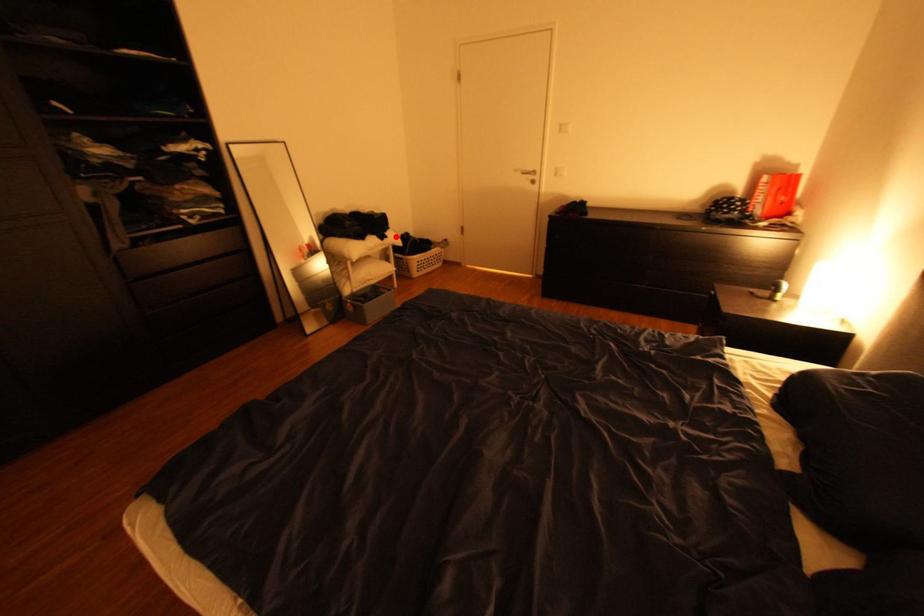
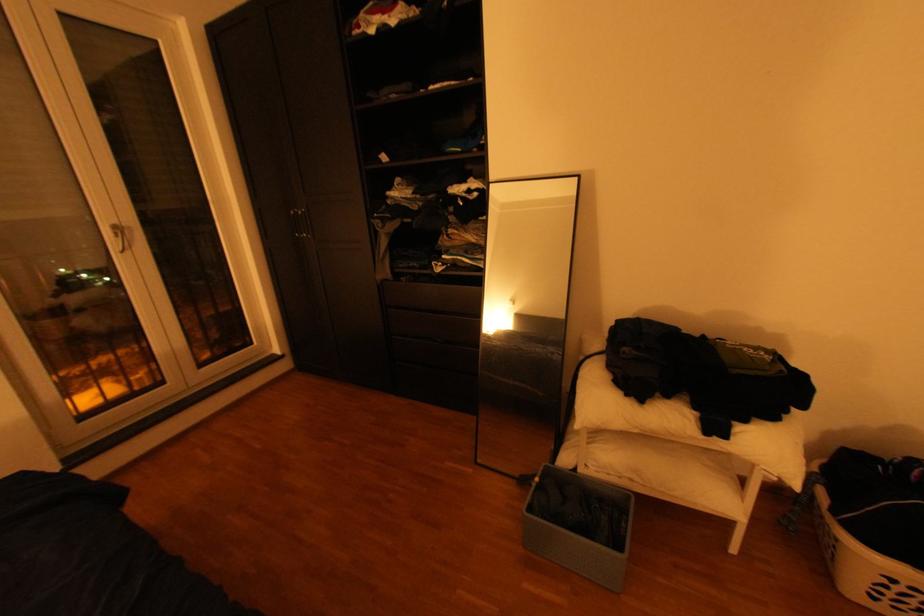
Question: I am providing you with two images of the same scene from different viewpoints. A red point is marked on the first image. Can you still see the location of the red point in image 2?

Choices:
 (A) Yes
 (B) No

Answer: (A)